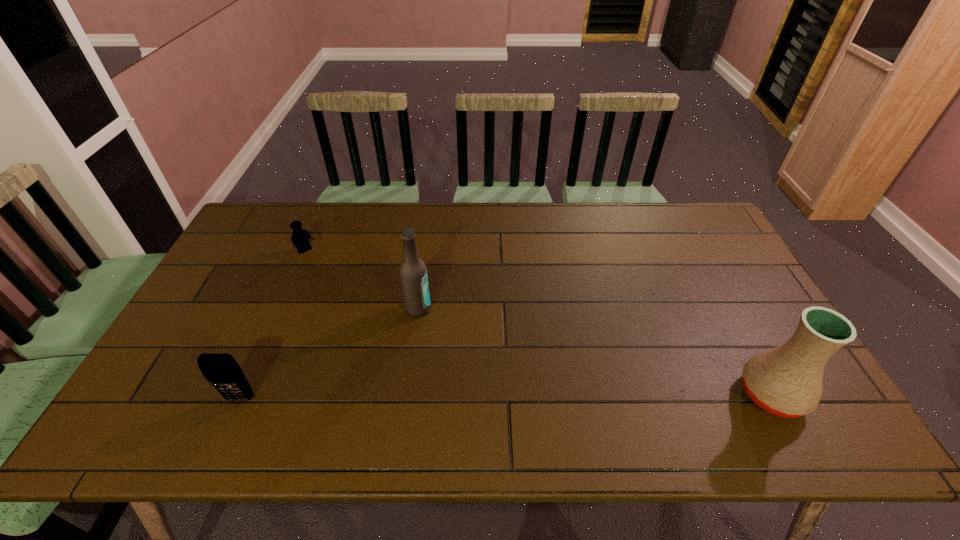
At what (x,y) coordinates should I click in order to perform the action: click on vacant region located on the side of the third nearest object with the label. Please return your answer as a coordinate pair (x, y). The image size is (960, 540). Looking at the image, I should click on (527, 388).

This screenshot has width=960, height=540. Find the location of `vacant space located on the side of the third nearest object with the label`. vacant space located on the side of the third nearest object with the label is located at coordinates (495, 365).

Where is `vacant space located on the side of the third nearest object with the label`? Image resolution: width=960 pixels, height=540 pixels. vacant space located on the side of the third nearest object with the label is located at coordinates (455, 336).

Locate an element on the screen. The height and width of the screenshot is (540, 960). cellular telephone that is positioned at the near edge is located at coordinates (221, 370).

You are a GUI agent. You are given a task and a screenshot of the screen. Output one action in this format:
    pyautogui.click(x=<x>, y=<y>)
    Task: Click on the pottery present at the near edge
    The height and width of the screenshot is (540, 960).
    Given the screenshot: What is the action you would take?
    pyautogui.click(x=786, y=381)

Find the location of a particular element. This screenshot has width=960, height=540. object present at the right edge is located at coordinates (786, 381).

Locate an element on the screen. The width and height of the screenshot is (960, 540). object positioned at the near right corner is located at coordinates (786, 381).

Where is `free region at the far edge of the desktop`? The width and height of the screenshot is (960, 540). free region at the far edge of the desktop is located at coordinates (665, 240).

The width and height of the screenshot is (960, 540). What are the coordinates of `vacant space at the near edge of the desktop` in the screenshot? It's located at (578, 389).

At what (x,y) coordinates should I click in order to perform the action: click on vacant area at the left edge of the desktop. Please return your answer as a coordinate pair (x, y). Looking at the image, I should click on (232, 266).